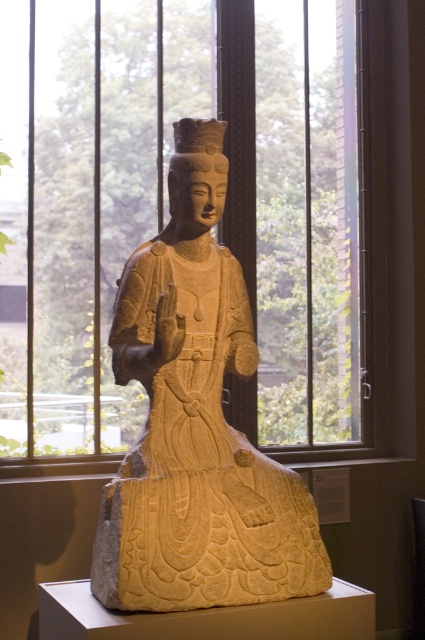
You are standing in front of the stone sculpture and want to take a photo of the point at coordinate [334,278]. If your camera is 3.60 meters away from the sculpture, will the point be in focus?

The point at coordinate [334,278] is exactly 3.60 meters away from the camera, so it will be in focus if the camera is focused at that distance.

In the scene shown: You are standing in front of the sculpture and want to take a photo through the clear glass window at center. Is the window positioned in the center of the image?

The clear glass window at center is located at coordinates point (167, 214), which is not exactly the center of the image. Therefore, the window is not positioned in the center of the image.